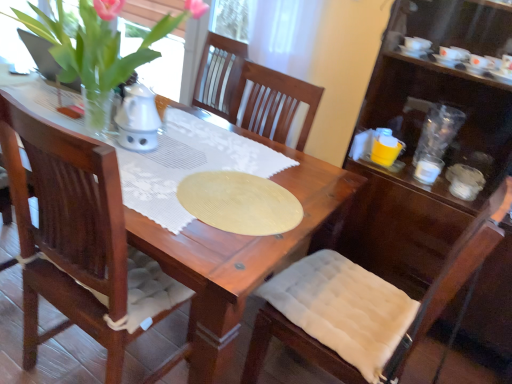
Question: Is white fabric cushion at lower right bigger than transparent plastic cups at right, marked as the second tableware in a bottom-to-top arrangement?

Choices:
 (A) no
 (B) yes

Answer: (B)

Question: Considering the relative sizes of white fabric cushion at lower right and transparent plastic cups at right, positioned as the 1th tableware in top-to-bottom order, in the image provided, is white fabric cushion at lower right taller than transparent plastic cups at right, positioned as the 1th tableware in top-to-bottom order,?

Choices:
 (A) no
 (B) yes

Answer: (B)

Question: Is white fabric cushion at lower right thinner than transparent plastic cups at right, positioned as the 1th tableware in top-to-bottom order?

Choices:
 (A) yes
 (B) no

Answer: (B)

Question: Is white fabric cushion at lower right to the left of transparent plastic cups at right, marked as the second tableware in a bottom-to-top arrangement, from the viewer's perspective?

Choices:
 (A) no
 (B) yes

Answer: (B)

Question: Does white fabric cushion at lower right lie in front of transparent plastic cups at right, marked as the second tableware in a bottom-to-top arrangement?

Choices:
 (A) yes
 (B) no

Answer: (A)

Question: In the image, is green leafy plant at upper left positioned in front of or behind white glossy cup at right, the second tableware viewed from the top?

Choices:
 (A) behind
 (B) front

Answer: (B)

Question: Is green leafy plant at upper left inside or outside of white glossy cup at right, marked as the first tableware in a bottom-to-top arrangement?

Choices:
 (A) inside
 (B) outside

Answer: (B)

Question: From the image's perspective, is green leafy plant at upper left positioned above or below white glossy cup at right, marked as the first tableware in a bottom-to-top arrangement?

Choices:
 (A) below
 (B) above

Answer: (B)

Question: From a real-world perspective, is green leafy plant at upper left physically located above or below white glossy cup at right, the second tableware viewed from the top?

Choices:
 (A) below
 (B) above

Answer: (B)

Question: Based on their sizes in the image, would you say white glossy cup at right, the second tableware viewed from the top, is bigger or smaller than white fabric cushion at lower right?

Choices:
 (A) big
 (B) small

Answer: (B)

Question: From the image's perspective, is white glossy cup at right, marked as the first tableware in a bottom-to-top arrangement, located above or below white fabric cushion at lower right?

Choices:
 (A) above
 (B) below

Answer: (A)

Question: Visually, is white glossy cup at right, the second tableware viewed from the top, positioned to the left or to the right of white fabric cushion at lower right?

Choices:
 (A) right
 (B) left

Answer: (A)

Question: Considering the positions of white glossy cup at right, the second tableware viewed from the top, and white fabric cushion at lower right in the image, is white glossy cup at right, the second tableware viewed from the top, wider or thinner than white fabric cushion at lower right?

Choices:
 (A) wide
 (B) thin

Answer: (B)

Question: From a real-world perspective, is transparent plastic cups at right, positioned as the 1th tableware in top-to-bottom order, above or below white fabric cushion at lower right?

Choices:
 (A) below
 (B) above

Answer: (B)

Question: From their relative heights in the image, would you say transparent plastic cups at right, positioned as the 1th tableware in top-to-bottom order, is taller or shorter than white fabric cushion at lower right?

Choices:
 (A) tall
 (B) short

Answer: (B)